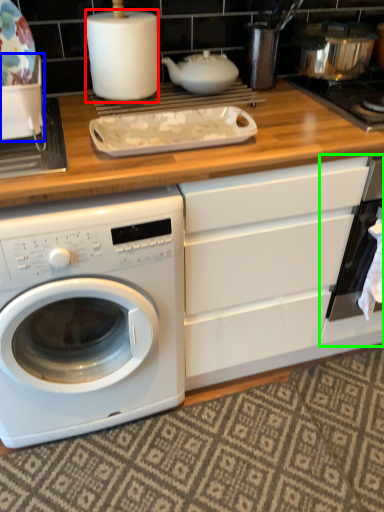
Question: Which object is the closest to the paper towel (highlighted by a red box)? Choose among these: appliance (highlighted by a blue box) or oven (highlighted by a green box).

Choices:
 (A) appliance
 (B) oven

Answer: (A)